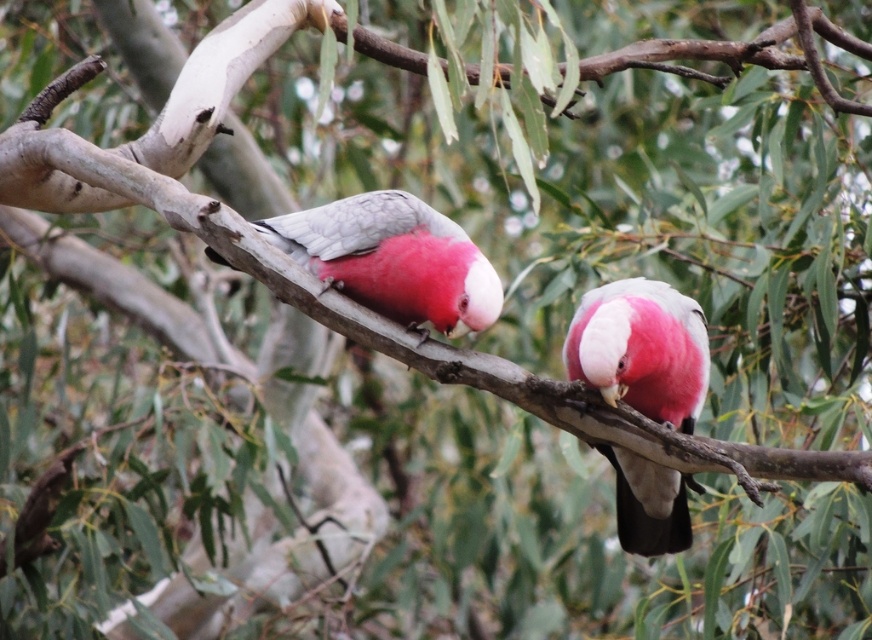
Which is more to the right, pink matte parrot at center or matte pink parrot at center?

Positioned to the right is pink matte parrot at center.

Does pink matte parrot at center come behind matte pink parrot at center?

No, it is in front of matte pink parrot at center.

Which is behind, point (687, 536) or point (385, 268)?

Positioned behind is point (687, 536).

Identify the location of pink matte parrot at center. (641, 349).